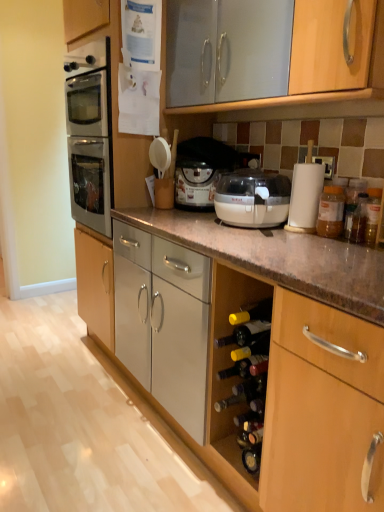
Question: Would you say translucent yellow glass wine bottle at lower center contains translucent plastic jar at right?

Choices:
 (A) yes
 (B) no

Answer: (B)

Question: From a real-world perspective, is translucent yellow glass wine bottle at lower center positioned over translucent plastic jar at right based on gravity?

Choices:
 (A) yes
 (B) no

Answer: (B)

Question: Does translucent yellow glass wine bottle at lower center have a lesser width compared to translucent plastic jar at right?

Choices:
 (A) yes
 (B) no

Answer: (B)

Question: Is translucent yellow glass wine bottle at lower center oriented away from translucent plastic jar at right?

Choices:
 (A) yes
 (B) no

Answer: (B)

Question: Can you confirm if translucent yellow glass wine bottle at lower center is positioned to the left of translucent plastic jar at right?

Choices:
 (A) no
 (B) yes

Answer: (B)

Question: Is translucent yellow glass wine bottle at lower center at the right side of translucent plastic jar at right?

Choices:
 (A) no
 (B) yes

Answer: (A)

Question: Is the depth of beige plastic food processor at center greater than that of matte white food processor at center?

Choices:
 (A) no
 (B) yes

Answer: (A)

Question: Does beige plastic food processor at center have a greater height compared to matte white food processor at center?

Choices:
 (A) no
 (B) yes

Answer: (A)

Question: From a real-world perspective, is beige plastic food processor at center located higher than matte white food processor at center?

Choices:
 (A) yes
 (B) no

Answer: (B)

Question: Is beige plastic food processor at center touching matte white food processor at center?

Choices:
 (A) no
 (B) yes

Answer: (A)

Question: Considering the relative positions of beige plastic food processor at center and matte white food processor at center in the image provided, is beige plastic food processor at center to the left of matte white food processor at center from the viewer's perspective?

Choices:
 (A) no
 (B) yes

Answer: (A)

Question: From a real-world perspective, is beige plastic food processor at center positioned under matte white food processor at center based on gravity?

Choices:
 (A) no
 (B) yes

Answer: (B)

Question: Considering the relative sizes of translucent yellow glass wine bottle at lower center and beige plastic food processor at center in the image provided, is translucent yellow glass wine bottle at lower center bigger than beige plastic food processor at center?

Choices:
 (A) no
 (B) yes

Answer: (A)